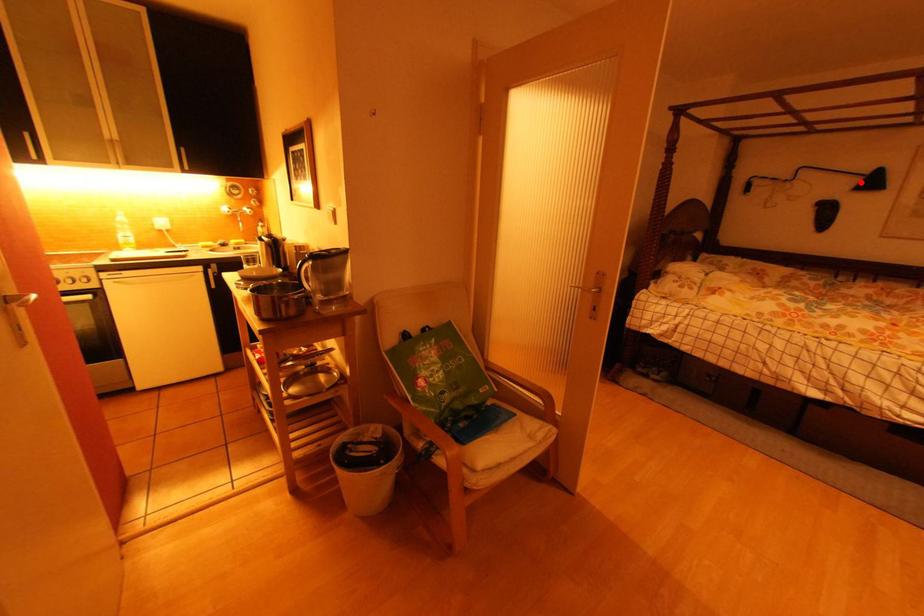
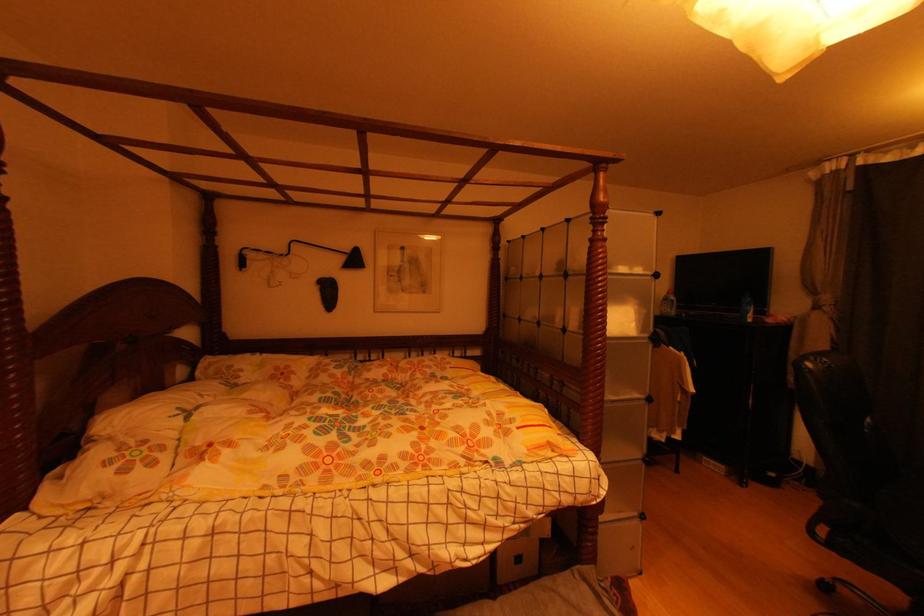
Question: I am providing you with two images of the same scene from different viewpoints. Given a red point in image1, look at the same physical point in image2. Is it:

Choices:
 (A) Closer to the viewpoint
 (B) Farther from the viewpoint

Answer: (A)